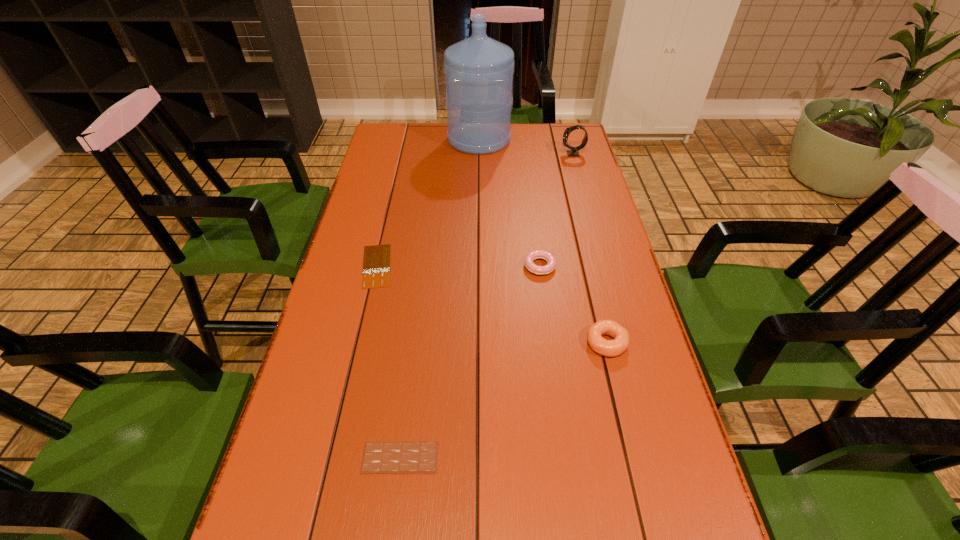
Where is `water jug`? water jug is located at coordinates (478, 70).

Where is `the second tallest object`? The height and width of the screenshot is (540, 960). the second tallest object is located at coordinates (574, 152).

At what (x,y) coordinates should I click in order to perform the action: click on the taller doughnut. Please return your answer as a coordinate pair (x, y). This screenshot has width=960, height=540. Looking at the image, I should click on (610, 348).

Image resolution: width=960 pixels, height=540 pixels. I want to click on the nearer doughnut, so click(610, 348).

At what (x,y) coordinates should I click in order to perform the action: click on the fourth object from left to right. Please return your answer as a coordinate pair (x, y). Image resolution: width=960 pixels, height=540 pixels. Looking at the image, I should click on (537, 254).

At what (x,y) coordinates should I click in order to perform the action: click on the left doughnut. Please return your answer as a coordinate pair (x, y). Looking at the image, I should click on (537, 254).

This screenshot has height=540, width=960. I want to click on the nearer chocolate bar, so click(420, 456).

What are the coordinates of `the right chocolate bar` in the screenshot? It's located at (420, 456).

You are a GUI agent. You are given a task and a screenshot of the screen. Output one action in this format:
    pyautogui.click(x=<x>, y=<y>)
    Task: Click on the shortest object
    
    Given the screenshot: What is the action you would take?
    pyautogui.click(x=376, y=266)

At what (x,y) coordinates should I click in order to perform the action: click on the shorter chocolate bar. Please return your answer as a coordinate pair (x, y). The image size is (960, 540). Looking at the image, I should click on (376, 266).